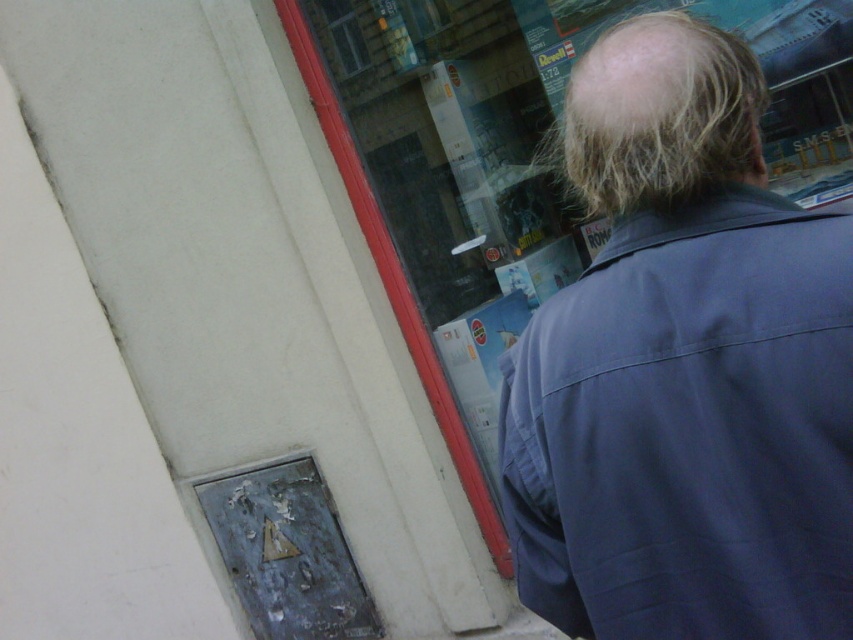
Question: Which point appears farthest from the camera in this image?

Choices:
 (A) (664, 275)
 (B) (666, 180)

Answer: (A)

Question: Does dark blue fabric at upper right appear on the right side of blonde hair at upper right?

Choices:
 (A) no
 (B) yes

Answer: (B)

Question: Is dark blue fabric at upper right wider than blonde hair at upper right?

Choices:
 (A) no
 (B) yes

Answer: (B)

Question: Is dark blue fabric at upper right to the right of blonde hair at upper right from the viewer's perspective?

Choices:
 (A) no
 (B) yes

Answer: (B)

Question: Which of the following is the closest to the observer?

Choices:
 (A) blonde hair at upper right
 (B) dark blue fabric at upper right

Answer: (B)